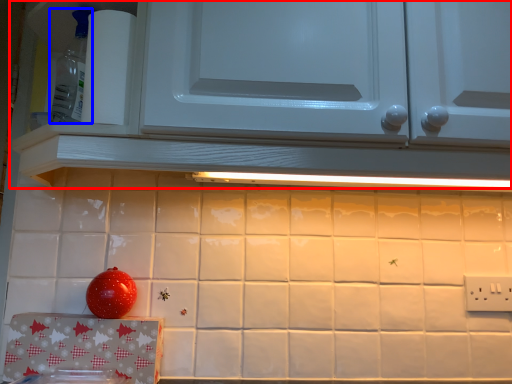
Question: Which object appears closest to the camera in this image, cabinetry (highlighted by a red box) or appliance (highlighted by a blue box)?

Choices:
 (A) cabinetry
 (B) appliance

Answer: (A)